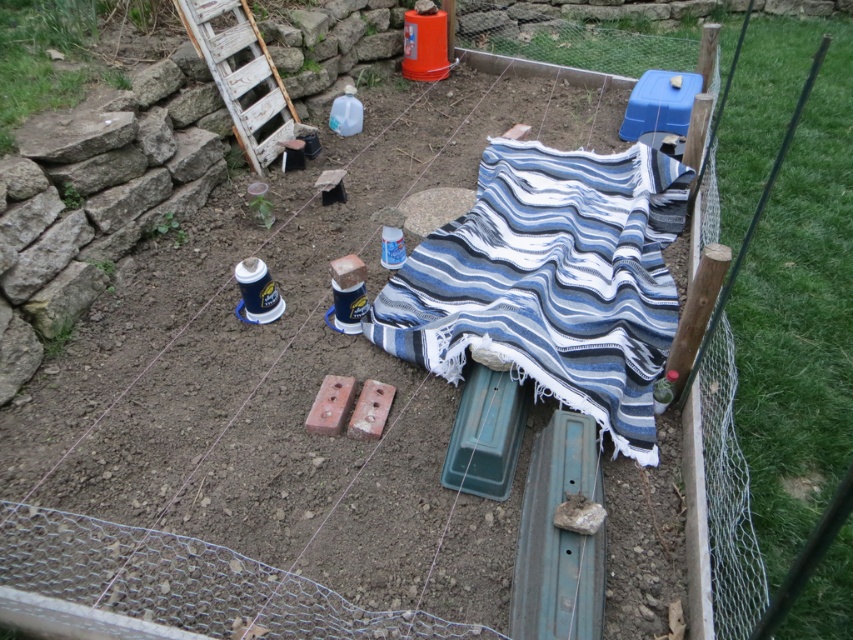
Does blue striped fabric at center have a smaller size compared to white weathered wood ladder at upper left?

Actually, blue striped fabric at center might be larger than white weathered wood ladder at upper left.

The width and height of the screenshot is (853, 640). What do you see at coordinates (549, 282) in the screenshot?
I see `blue striped fabric at center` at bounding box center [549, 282].

At what (x,y) coordinates should I click in order to perform the action: click on blue striped fabric at center. Please return your answer as a coordinate pair (x, y). Looking at the image, I should click on (549, 282).